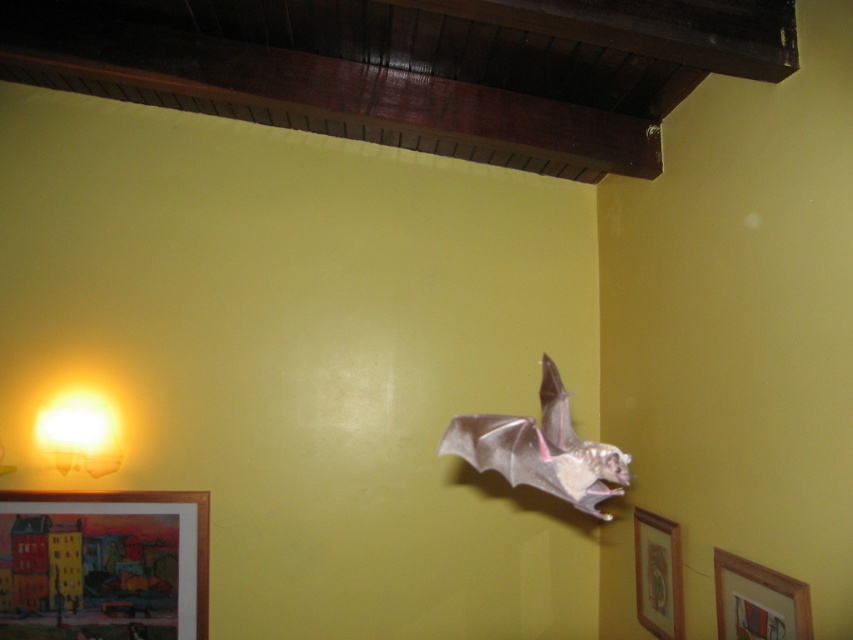
Is wooden picture frame at upper right positioned behind matte yellow glass lamp at lower left?

No, it is not.

What are the coordinates of `wooden picture frame at upper right` in the screenshot? It's located at (758, 600).

Is point (809, 616) closer to camera compared to point (67, 404)?

That is True.

Where is `wooden picture frame at upper right`? This screenshot has width=853, height=640. wooden picture frame at upper right is located at coordinates (758, 600).

Who is lower down, wooden framed painting at lower left or wooden picture frame at lower right?

wooden framed painting at lower left is below.

Can you confirm if wooden framed painting at lower left is positioned below wooden picture frame at lower right?

Correct, wooden framed painting at lower left is located below wooden picture frame at lower right.

Which is in front, point (125, 584) or point (669, 556)?

Positioned in front is point (669, 556).

Locate an element on the screen. wooden framed painting at lower left is located at coordinates (103, 564).

Can you confirm if wooden framed painting at lower left is shorter than matte yellow glass lamp at lower left?

No.

Does wooden framed painting at lower left have a greater height compared to matte yellow glass lamp at lower left?

Yes.

This screenshot has height=640, width=853. I want to click on wooden framed painting at lower left, so click(x=103, y=564).

Where is `wooden framed painting at lower left`? The height and width of the screenshot is (640, 853). wooden framed painting at lower left is located at coordinates (103, 564).